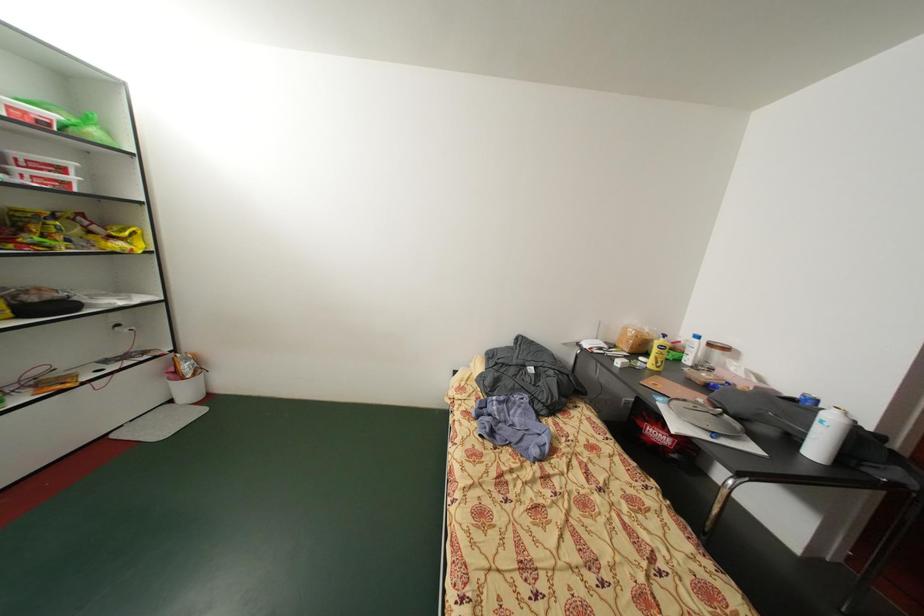
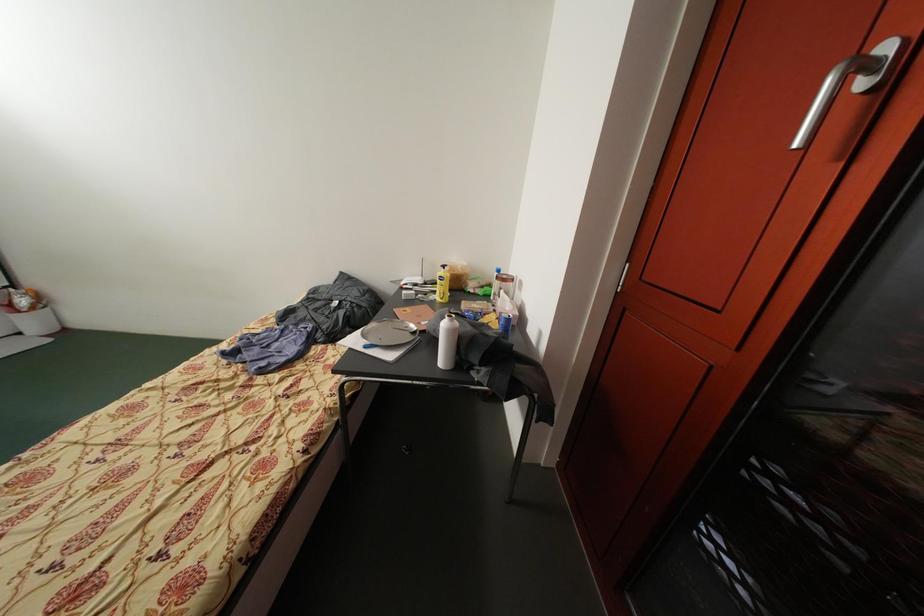
Question: In a continuous first-person perspective shot, in which direction is the camera moving?

Choices:
 (A) Left
 (B) Right
 (C) Forward
 (D) Backward

Answer: (B)